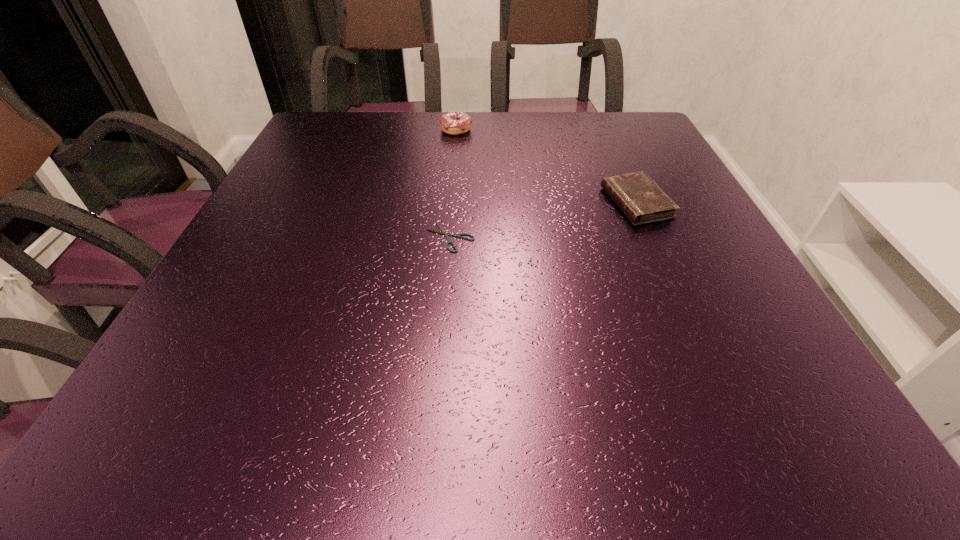
The width and height of the screenshot is (960, 540). Identify the location of doughnut. (454, 123).

The image size is (960, 540). I want to click on the tallest object, so click(454, 123).

You are a GUI agent. You are given a task and a screenshot of the screen. Output one action in this format:
    pyautogui.click(x=<x>, y=<y>)
    Task: Click on the rightmost object
    This screenshot has height=540, width=960.
    Given the screenshot: What is the action you would take?
    pyautogui.click(x=636, y=194)

Where is `diary`? Image resolution: width=960 pixels, height=540 pixels. diary is located at coordinates (636, 194).

The height and width of the screenshot is (540, 960). I want to click on shears, so click(443, 231).

Where is `vacant area situated 0.170m on the right of the farthest object`? The image size is (960, 540). vacant area situated 0.170m on the right of the farthest object is located at coordinates (533, 130).

The height and width of the screenshot is (540, 960). In order to click on free space located 0.140m on the left of the diary in this screenshot , I will do `click(541, 203)`.

Find the location of `free space located on the left of the shears`. free space located on the left of the shears is located at coordinates (381, 238).

Where is `object located in the far edge section of the desktop`? object located in the far edge section of the desktop is located at coordinates (454, 123).

The image size is (960, 540). I want to click on object that is at the right edge, so click(636, 194).